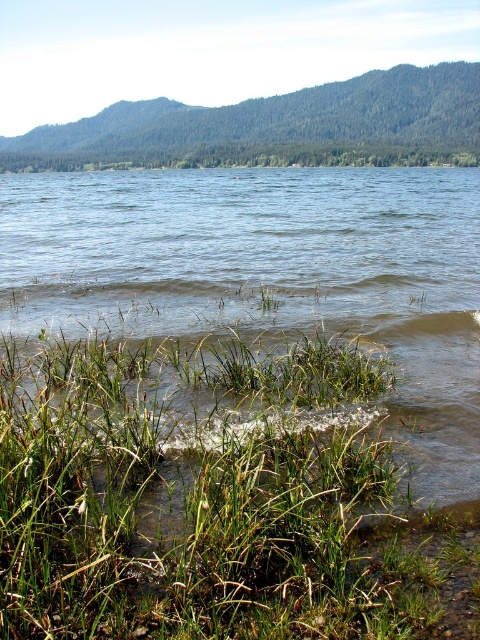
You are standing at the point marked as point (206,497) in the image. Looking towards the green grassy area at lower left, which direction should you walk to reach the dense line of evergreen trees in the midground?

The point (206,497) is located on the green grassy area at lower left. To reach the dense line of evergreen trees in the midground, you should walk towards the upper right direction since the trees are situated in the midground beyond the grassy area.

You are standing at the edge of the lake and want to walk from the green grassy at lower left to the green grass at lower center. Which path would you take if you prefer a wider area to walk on?

You should walk towards the green grass at lower center because it has a greater width compared to the green grassy at lower left, providing a wider path for walking.